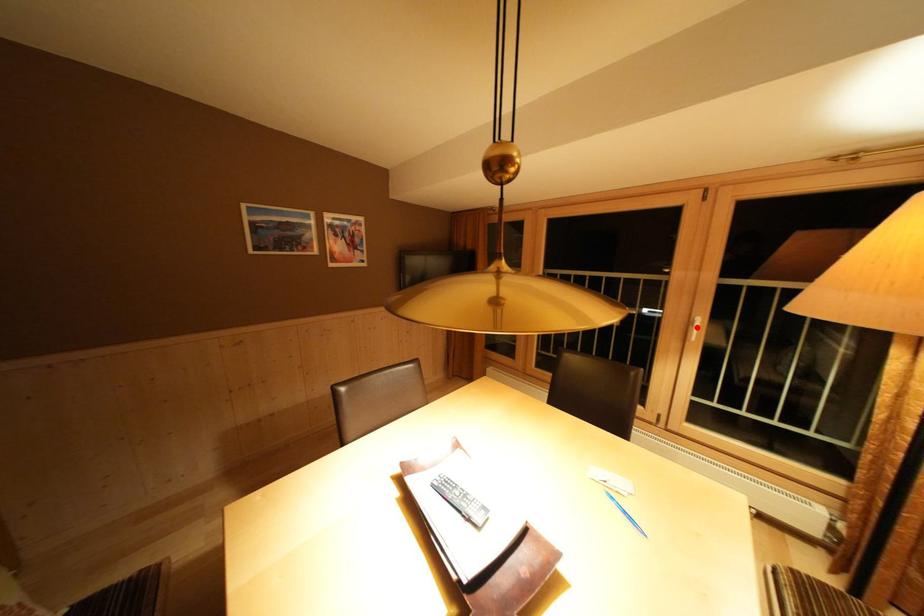
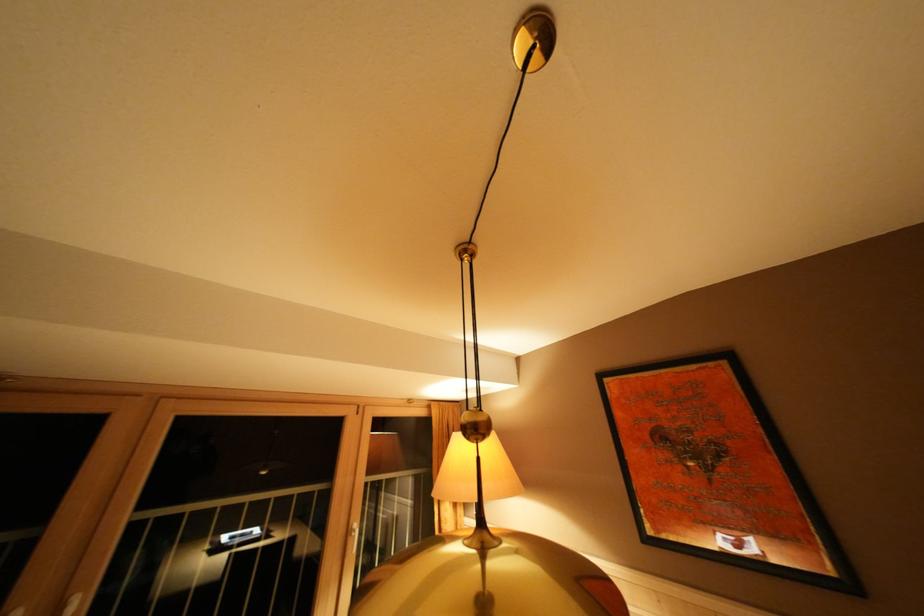
Find the pixel in the second image that matches the highlighted location in the first image.

(355, 537)